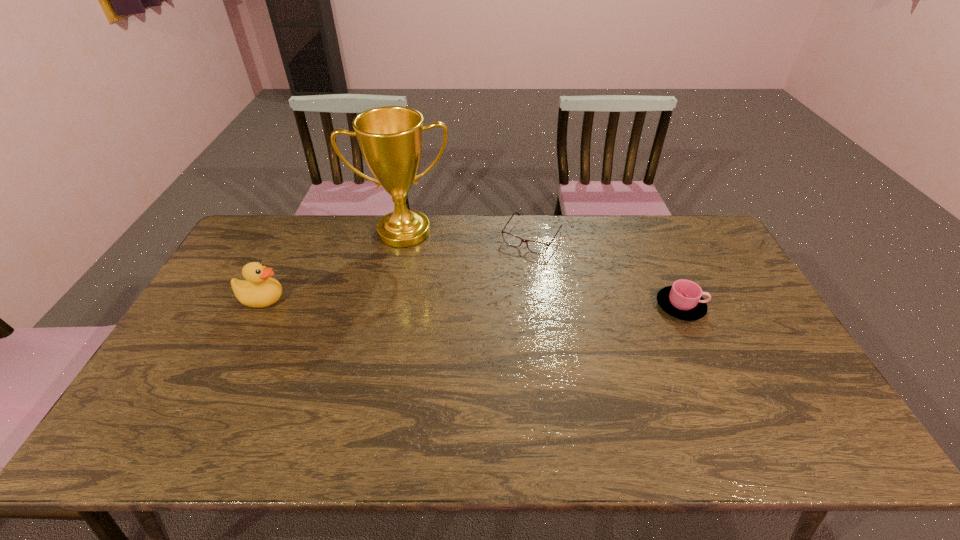
Locate an element on the screen. blank area located by the handles of the tallest object is located at coordinates (417, 319).

Find the location of a particular element. vacant area located by the handles of the tallest object is located at coordinates (418, 332).

I want to click on vacant region located by the handles of the tallest object, so click(411, 263).

Locate an element on the screen. vacant area situated on the lenses of the second object from right to left is located at coordinates (481, 315).

Locate an element on the screen. The width and height of the screenshot is (960, 540). vacant region located 0.090m on the lenses of the second object from right to left is located at coordinates (510, 270).

Locate an element on the screen. Image resolution: width=960 pixels, height=540 pixels. vacant space situated 0.060m on the lenses of the second object from right to left is located at coordinates [x=514, y=264].

At what (x,y) coordinates should I click in order to perform the action: click on award that is at the far edge. Please return your answer as a coordinate pair (x, y). Looking at the image, I should click on click(x=390, y=138).

Identify the location of spectacles at the far edge. (534, 246).

You are a GUI agent. You are given a task and a screenshot of the screen. Output one action in this format:
    pyautogui.click(x=<x>, y=<y>)
    Task: Click on the object present at the left edge
    This screenshot has height=540, width=960.
    Given the screenshot: What is the action you would take?
    pyautogui.click(x=258, y=290)

Find the location of a particular element. The height and width of the screenshot is (540, 960). object that is at the right edge is located at coordinates (683, 300).